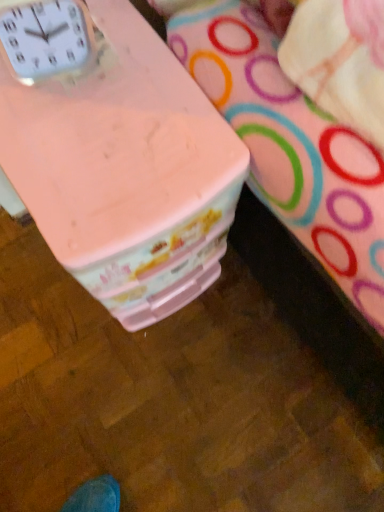
Question: From the image's perspective, is pink plastic container at center positioned above or below white plastic clock at upper left?

Choices:
 (A) below
 (B) above

Answer: (A)

Question: Which is correct: pink plastic container at center is inside white plastic clock at upper left, or outside of it?

Choices:
 (A) outside
 (B) inside

Answer: (A)

Question: Is pink plastic container at center to the left or to the right of white plastic clock at upper left in the image?

Choices:
 (A) left
 (B) right

Answer: (B)

Question: Based on their sizes in the image, would you say white plastic clock at upper left is bigger or smaller than pink plastic container at center?

Choices:
 (A) big
 (B) small

Answer: (B)

Question: Considering the positions of point click(x=48, y=30) and point click(x=122, y=287), is point click(x=48, y=30) closer or farther from the camera than point click(x=122, y=287)?

Choices:
 (A) farther
 (B) closer

Answer: (B)

Question: Considering their positions, is white plastic clock at upper left located in front of or behind pink plastic container at center?

Choices:
 (A) behind
 (B) front

Answer: (B)

Question: From a real-world perspective, is white plastic clock at upper left positioned above or below pink plastic container at center?

Choices:
 (A) below
 (B) above

Answer: (B)